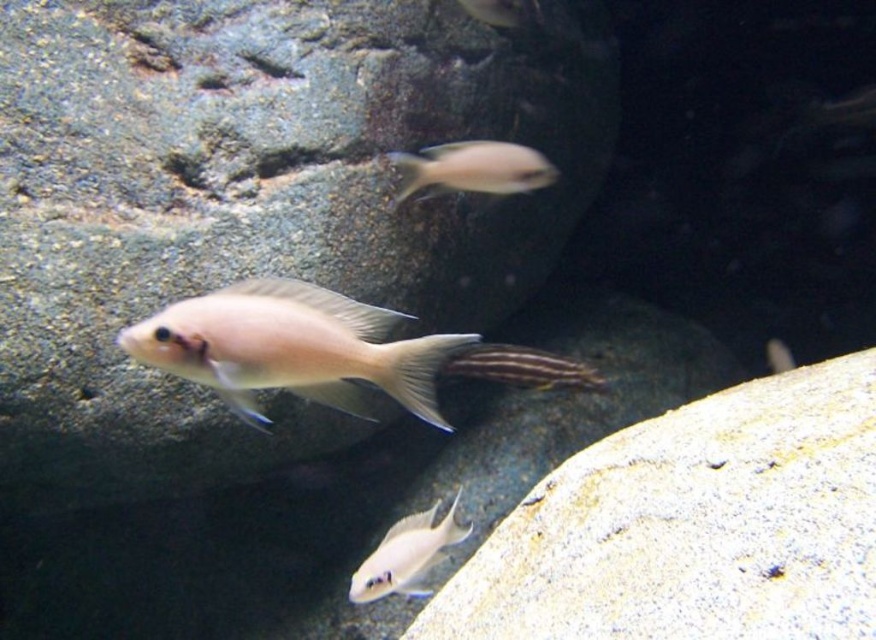
Who is positioned more to the right, white matte rock at lower right or striped fin at center?

Positioned to the right is white matte rock at lower right.

You are a GUI agent. You are given a task and a screenshot of the screen. Output one action in this format:
    pyautogui.click(x=<x>, y=<y>)
    Task: Click on the white matte rock at lower right
    Image resolution: width=876 pixels, height=640 pixels.
    Given the screenshot: What is the action you would take?
    pyautogui.click(x=691, y=525)

At what (x,y) coordinates should I click in order to perform the action: click on white matte rock at lower right. Please return your answer as a coordinate pair (x, y). This screenshot has width=876, height=640. Looking at the image, I should click on (691, 525).

Between matte white fish at upper center and striped fin at center, which one is positioned higher?

matte white fish at upper center

Is matte white fish at upper center above striped fin at center?

Indeed, matte white fish at upper center is positioned over striped fin at center.

Who is more distant from viewer, (491, 189) or (523, 362)?

Positioned behind is point (523, 362).

What are the coordinates of `matte white fish at upper center` in the screenshot? It's located at (472, 168).

Who is lower down, white matte rock at lower right or pale pink matte fish at center?

white matte rock at lower right

Between point (809, 563) and point (238, 298), which one is positioned behind?

The point (238, 298) is more distant.

This screenshot has height=640, width=876. I want to click on white matte rock at lower right, so click(x=691, y=525).